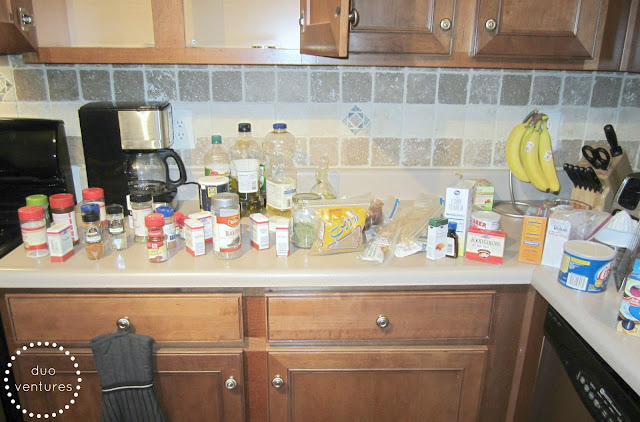
Identify the location of knife block. Image resolution: width=640 pixels, height=422 pixels. (598, 172).